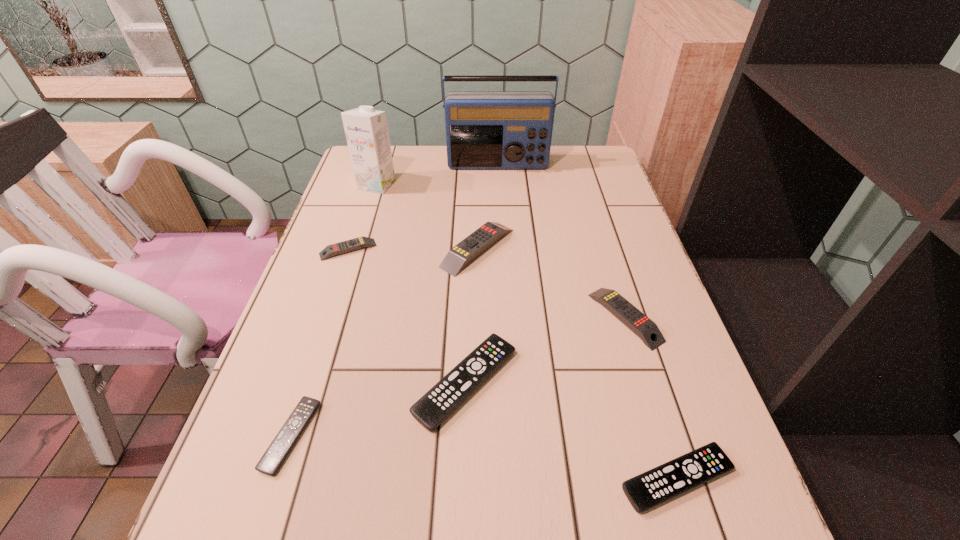
Identify the location of blue radio receiver. This screenshot has height=540, width=960. (484, 129).

Identify the location of radio receiver. 484,129.

At what (x,y) coordinates should I click in order to perform the action: click on the second farthest object. Please return your answer as a coordinate pair (x, y). The width and height of the screenshot is (960, 540). Looking at the image, I should click on (366, 130).

Identify the location of the second tallest object. (366, 130).

The image size is (960, 540). I want to click on the tallest remote control, so click(460, 255).

This screenshot has width=960, height=540. In order to click on the biggest yellow remote control in this screenshot , I will do `click(460, 255)`.

What are the coordinates of `the second smallest yellow remote control` in the screenshot? It's located at (639, 323).

The image size is (960, 540). I want to click on the rightmost yellow remote control, so click(639, 323).

You are a GUI agent. You are given a task and a screenshot of the screen. Output one action in this format:
    pyautogui.click(x=<x>, y=<y>)
    Task: Click on the biggest black remote control
    This screenshot has width=960, height=540.
    Given the screenshot: What is the action you would take?
    pyautogui.click(x=453, y=389)

Identify the location of the leftmost yellow remote control. The width and height of the screenshot is (960, 540). (331, 250).